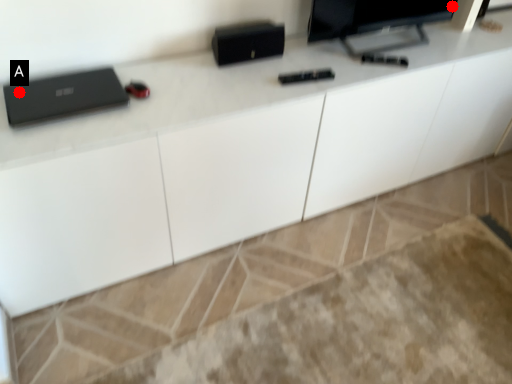
Question: Two points are circled on the image, labeled by A and B beside each circle. Which point is farther from the camera taking this photo?

Choices:
 (A) A is further
 (B) B is further

Answer: (B)